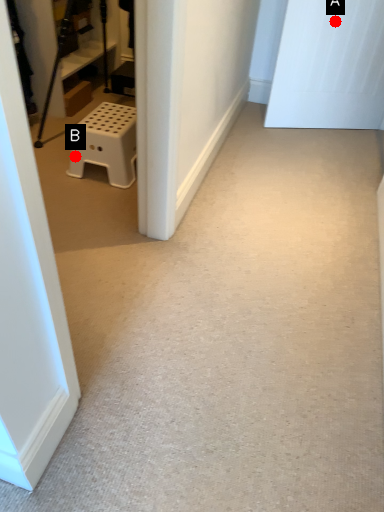
Question: Two points are circled on the image, labeled by A and B beside each circle. Which point is closer to the camera?

Choices:
 (A) A is closer
 (B) B is closer

Answer: (B)